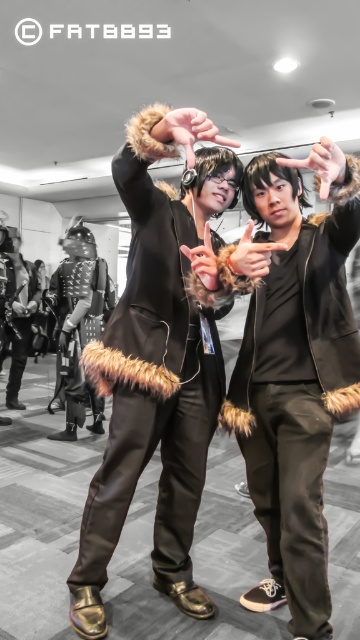
Based on the photo, you are standing at the point with coordinates point (24,316) and want to take a photo of the person at point (200,193). Is there any obstruction between you and your target?

Point (200,193) is in front of point (24,316), so there is no obstruction between you and the target. You can take the photo without any issues.

You are standing at the center of the convention hall and see the point marked at coordinates (294, 376). What object is located exactly at that point?

The object located exactly at point (294, 376) is the furry black jacket at center.

You are a photographer at a convention. You need to capture a photo of the furry black jacket at center and studded leather armor at center. Which one is positioned lower in the frame?

The furry black jacket at center is positioned lower in the frame because it is below the studded leather armor at center.